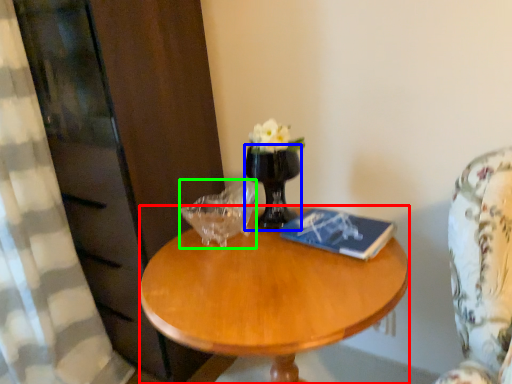
Question: Based on their relative distances, which object is nearer to coffee table (highlighted by a red box)? Choose from vase (highlighted by a blue box) and candle holder (highlighted by a green box).

Choices:
 (A) vase
 (B) candle holder

Answer: (B)